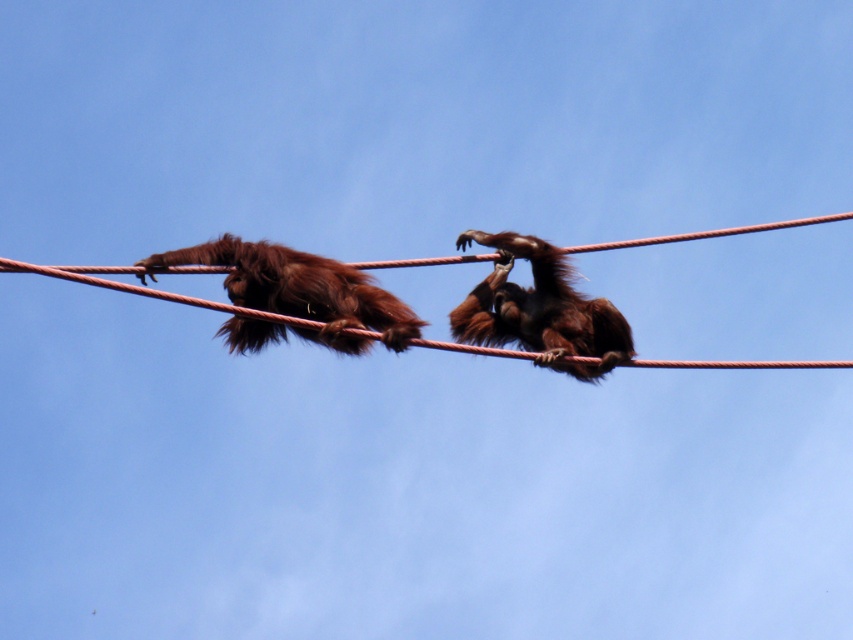
Can you confirm if brown furry monkey at upper left is wider than brown furry monkey at center?

Correct, the width of brown furry monkey at upper left exceeds that of brown furry monkey at center.

Who is shorter, brown furry monkey at upper left or brown furry monkey at center?

brown furry monkey at upper left is shorter.

Does point (229, 349) lie in front of point (524, 321)?

That is True.

In order to click on brown furry monkey at upper left in this screenshot , I will do `click(300, 291)`.